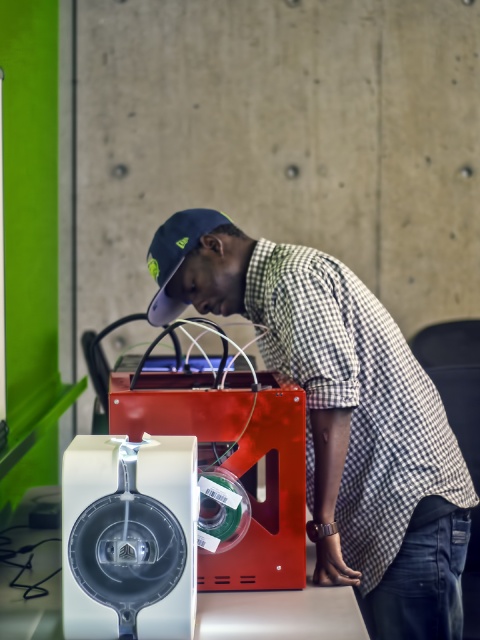
Who is higher up, checkered fabric shirt at center or navy blue fabric baseball cap at center?

navy blue fabric baseball cap at center is higher up.

Does checkered fabric shirt at center have a lesser height compared to navy blue fabric baseball cap at center?

In fact, checkered fabric shirt at center may be taller than navy blue fabric baseball cap at center.

The width and height of the screenshot is (480, 640). I want to click on checkered fabric shirt at center, so click(x=342, y=417).